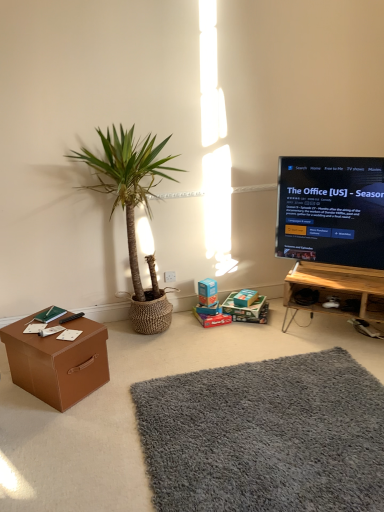
This screenshot has width=384, height=512. Describe the element at coordinates (245, 309) in the screenshot. I see `cardboard box at center, which is counted as the first cardboard box, starting from the right` at that location.

The height and width of the screenshot is (512, 384). What do you see at coordinates (265, 436) in the screenshot? I see `gray shaggy rug at lower center` at bounding box center [265, 436].

In order to face cardboard box at center, the first cardboard box positioned from the left, should I rotate leftwards or rightwards?

You should look right and rotate roughly 2.733 degrees.

The image size is (384, 512). What do you see at coordinates (133, 210) in the screenshot? I see `green woven basket at left` at bounding box center [133, 210].

This screenshot has height=512, width=384. I want to click on matte cardboard box at lower center, the third box positioned from the front, so [208, 309].

Is green woven basket at left surrounded by matte cardboard box at lower center, arranged as the third box when viewed from the left?

No, green woven basket at left is not inside matte cardboard box at lower center, arranged as the third box when viewed from the left.

Is matte cardboard box at lower center, arranged as the third box when viewed from the left, in front of green woven basket at left?

No, matte cardboard box at lower center, arranged as the third box when viewed from the left, is further to the viewer.

In terms of height, does matte cardboard box at lower center, the third box positioned from the front, look taller or shorter compared to green woven basket at left?

Considering their sizes, matte cardboard box at lower center, the third box positioned from the front, has less height than green woven basket at left.

At what (x,y) coordinates should I click in order to perform the action: click on houseplant on the left of matte cardboard box at lower center, which ranks as the 1th box in back-to-front order. Please return your answer as a coordinate pair (x, y). Looking at the image, I should click on (133, 210).

Does black glossy tv at right have a larger size compared to green woven basket at left?

Actually, black glossy tv at right might be smaller than green woven basket at left.

From the image's perspective, which one is positioned lower, black glossy tv at right or green woven basket at left?

green woven basket at left appears lower in the image.

Is black glossy tv at right directly adjacent to green woven basket at left?

There is a gap between black glossy tv at right and green woven basket at left.

Which point is more forward, (353, 161) or (151, 159)?

The point (353, 161) is in front.

Is wooden at lower right surrounded by brown cardboard box at lower left, the first box from the left?

No, wooden at lower right is not inside brown cardboard box at lower left, the first box from the left.

From the image's perspective, which is below, brown cardboard box at lower left, the third box from the back, or wooden at lower right?

brown cardboard box at lower left, the third box from the back, appears lower in the image.

Does brown cardboard box at lower left, the third box from the back, have a lesser height compared to wooden at lower right?

Yes, brown cardboard box at lower left, the third box from the back, is shorter than wooden at lower right.

Looking at this image, how far apart are brown cardboard box at lower left, positioned as the third box in right-to-left order, and wooden at lower right?

A distance of 5.18 feet exists between brown cardboard box at lower left, positioned as the third box in right-to-left order, and wooden at lower right.

Which object is positioned more to the right, black glossy tv at right or gray shaggy rug at lower center?

From the viewer's perspective, black glossy tv at right appears more on the right side.

Is black glossy tv at right bigger or smaller than gray shaggy rug at lower center?

Considering their sizes, black glossy tv at right takes up more space than gray shaggy rug at lower center.

Which is farther, [333,192] or [191,382]?

The point [333,192] is farther from the camera.

In the scene shown: From a real-world perspective, is black glossy tv at right positioned above or below gray shaggy rug at lower center?

black glossy tv at right is above gray shaggy rug at lower center.

Would you consider black glossy tv at right to be distant from black plastic remote control at lower left?

Indeed, black glossy tv at right is not near black plastic remote control at lower left.

From a real-world perspective, is black glossy tv at right physically above black plastic remote control at lower left?

Yes, from a real-world perspective, black glossy tv at right is over black plastic remote control at lower left

From their relative heights in the image, would you say black glossy tv at right is taller or shorter than black plastic remote control at lower left?

black glossy tv at right is taller than black plastic remote control at lower left.

Is black glossy tv at right facing away from black plastic remote control at lower left?

No.

From a real-world perspective, is cardboard box at center, acting as the second cardboard box starting from the right, positioned over blue cardboard box at center, which is counted as the second box, starting from the left, based on gravity?

Actually, cardboard box at center, acting as the second cardboard box starting from the right, is physically below blue cardboard box at center, which is counted as the second box, starting from the left, in the real world.

From their relative heights in the image, would you say cardboard box at center, the first cardboard box positioned from the left, is taller or shorter than blue cardboard box at center, which is the second box in back-to-front order?

Clearly, cardboard box at center, the first cardboard box positioned from the left, is shorter compared to blue cardboard box at center, which is the second box in back-to-front order.

Is cardboard box at center, positioned as the 2th cardboard box in left-to-right order, thinner than brown cardboard box at lower left, which is the 1th box from front to back?

Yes, cardboard box at center, positioned as the 2th cardboard box in left-to-right order, is thinner than brown cardboard box at lower left, which is the 1th box from front to back.

Is cardboard box at center, which is counted as the first cardboard box, starting from the right, facing towards brown cardboard box at lower left, positioned as the third box in right-to-left order?

Yes.

From the image's perspective, is cardboard box at center, which is counted as the first cardboard box, starting from the right, located above brown cardboard box at lower left, the third box from the back?

Indeed, from the image's perspective, cardboard box at center, which is counted as the first cardboard box, starting from the right, is shown above brown cardboard box at lower left, the third box from the back.

Locate an element on the screen. The width and height of the screenshot is (384, 512). houseplant to the left of matte cardboard box at lower center, marked as the first box in a right-to-left arrangement is located at coordinates (133, 210).

I want to click on houseplant below the black glossy tv at right (from the image's perspective), so click(x=133, y=210).

From the image, which object appears to be farther from wooden at lower right, cardboard box at center, positioned as the 2th cardboard box in left-to-right order, or green woven basket at left?

Based on the image, green woven basket at left appears to be further to wooden at lower right.

Looking at the image, which one is located closer to black plastic remote control at lower left, blue cardboard box at center, which is the second box in back-to-front order, or matte brown cardboard box at lower center?

Among the two, blue cardboard box at center, which is the second box in back-to-front order, is located nearer to black plastic remote control at lower left.

When comparing their distances from matte cardboard box at lower center, arranged as the third box when viewed from the left, does gray shaggy rug at lower center or black plastic remote control at lower left seem further?

gray shaggy rug at lower center is positioned further to the anchor matte cardboard box at lower center, arranged as the third box when viewed from the left.

Based on their spatial positions, is wooden at lower right or brown cardboard box at lower left, the third box from the back, further from green woven basket at left?

Among the two, wooden at lower right is located further to green woven basket at left.

Estimate the real-world distances between objects in this image. Which object is further from cardboard box at center, the first cardboard box positioned from the left, matte brown cardboard box at lower center or black plastic remote control at lower left?

black plastic remote control at lower left is further to cardboard box at center, the first cardboard box positioned from the left.

From the image, which object appears to be nearer to matte brown cardboard box at lower center, black glossy tv at right or green woven basket at left?

Based on the image, black glossy tv at right appears to be nearer to matte brown cardboard box at lower center.

From the image, which object appears to be nearer to brown cardboard box at lower left, the first box from the left, gray shaggy rug at lower center or black plastic remote control at lower left?

black plastic remote control at lower left.

When comparing their distances from matte brown cardboard box at lower center, does cardboard box at center, positioned as the 2th cardboard box in left-to-right order, or gray shaggy rug at lower center seem further?

Among the two, gray shaggy rug at lower center is located further to matte brown cardboard box at lower center.

At what (x,y) coordinates should I click in order to perform the action: click on remote control between brown cardboard box at lower left, positioned as the third box in right-to-left order, and cardboard box at center, acting as the second cardboard box starting from the right, in the horizontal direction. Please return your answer as a coordinate pair (x, y). Looking at the image, I should click on (71, 318).

Image resolution: width=384 pixels, height=512 pixels. What are the coordinates of `houseplant between brown cardboard box at lower left, the third box from the back, and wooden at lower right, in the horizontal direction` in the screenshot? It's located at (133, 210).

Image resolution: width=384 pixels, height=512 pixels. Find the location of `storage box between black plastic remote control at lower left and wooden at lower right from left to right`. storage box between black plastic remote control at lower left and wooden at lower right from left to right is located at coordinates (245, 298).

The height and width of the screenshot is (512, 384). Identify the location of remote control between gray shaggy rug at lower center and cardboard box at center, acting as the second cardboard box starting from the right, along the z-axis. (71, 318).